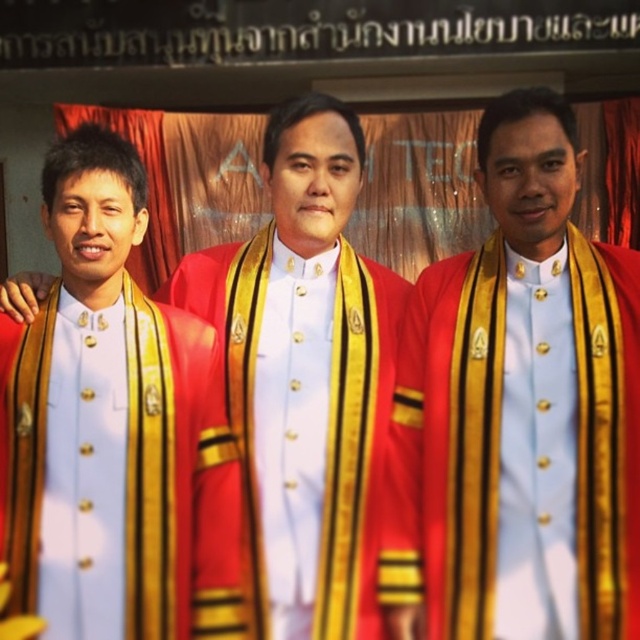
In the scene shown: You are a photographer setting up for a group photo. You notice the matte gold sash at center and the red velvet robe at center. Which object is located to the left of the other?

The matte gold sash at center is positioned on the left side of red velvet robe at center.

You are a photographer standing in front of the three individuals in the image. You want to adjust your camera to focus on the point that is closer to you. Which point should you focus on, point [336,442] or point [332,356]?

Point [336,442] is in front of point [332,356], so you should focus on point [336,442] since it is closer to you.